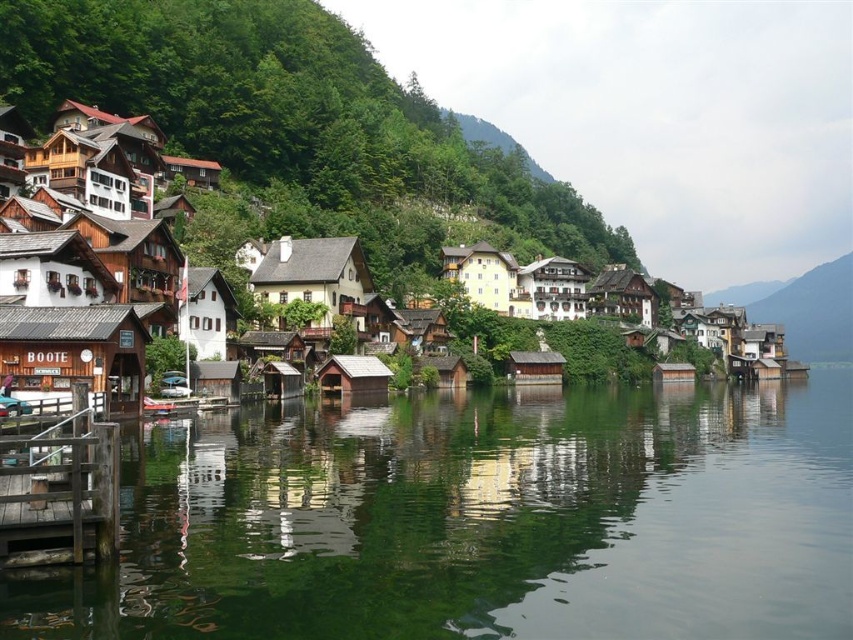
You are a tourist planning to take a photo of the wooden cabin at center right from the wooden pier on the left. Since the green reflective water at lower center is between you and the cabin, will the water block your view of the cabin?

The green reflective water at lower center has a lesser width compared to wooden cabin at center right, so the water is narrower than the cabin. This means the cabin extends beyond the water on both sides, so the water won not block your view of the cabin.

You are a tourist visiting the lakeside village and want to take a photo of the wooden cabin at center right with the green reflective water at lower center in the background. Where should you position yourself to ensure both are visible in the frame?

Position yourself to the right of the wooden cabin at center right so that the green reflective water at lower center, which is to the left of the cabin, will be visible in the background.

You are a visitor standing at the edge of the lakeside village. You notice the green reflective water at lower center and the wooden dock at lower left. Which of these two features occupies a bigger area in the scene?

The green reflective water at lower center has a larger size compared to the wooden dock at lower left, so it occupies a bigger area in the scene.